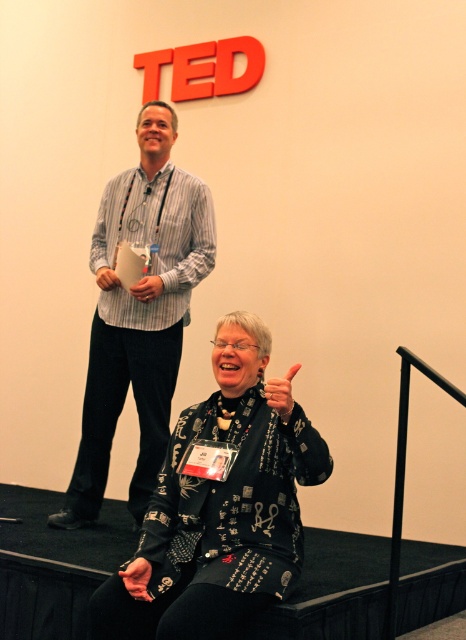
Is point (157, 616) farther from camera compared to point (73, 483)?

That is False.

Which is more to the right, printed fabric sweater at lower center or striped cotton shirt at upper left?

printed fabric sweater at lower center

Is point (261, 488) more distant than point (160, 176)?

No, (261, 488) is closer to viewer.

Locate an element on the screen. The image size is (466, 640). printed fabric sweater at lower center is located at coordinates (220, 508).